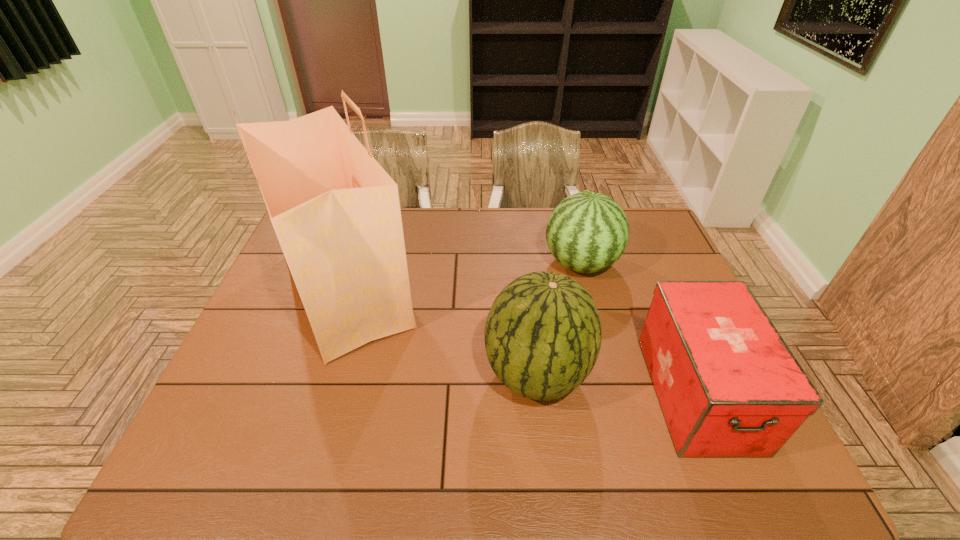
Where is `vacant space in between the nearer watermelon and the shortest object`? This screenshot has width=960, height=540. vacant space in between the nearer watermelon and the shortest object is located at coordinates (617, 383).

Where is `free area in between the farther watermelon and the grocery bag`? The width and height of the screenshot is (960, 540). free area in between the farther watermelon and the grocery bag is located at coordinates (463, 277).

The width and height of the screenshot is (960, 540). I want to click on vacant area that lies between the nearer watermelon and the leftmost object, so click(x=441, y=333).

Image resolution: width=960 pixels, height=540 pixels. Identify the location of free area in between the shortest object and the farther watermelon. (639, 328).

Where is `free space between the farther watermelon and the grocery bag`? Image resolution: width=960 pixels, height=540 pixels. free space between the farther watermelon and the grocery bag is located at coordinates tap(463, 277).

I want to click on empty space between the farther watermelon and the shortest object, so click(639, 328).

Locate an element on the screen. free space between the farther watermelon and the first-aid kit is located at coordinates (639, 328).

Identify which object is the nearest to the tallest object. Please provide its 2D coordinates. Your answer should be formatted as a tuple, i.e. [(x, y)], where the tuple contains the x and y coordinates of a point satisfying the conditions above.

[(543, 334)]

This screenshot has height=540, width=960. I want to click on object that stands as the second closest to the farther watermelon, so click(x=728, y=385).

You are a GUI agent. You are given a task and a screenshot of the screen. Output one action in this format:
    pyautogui.click(x=<x>, y=<y>)
    Task: Click on the vacant space that satisfies the following two spatial constraints: 1. on the front side of the farther watermelon; 2. on the side of the leftmost object with the superhero design
    
    Given the screenshot: What is the action you would take?
    pyautogui.click(x=588, y=291)